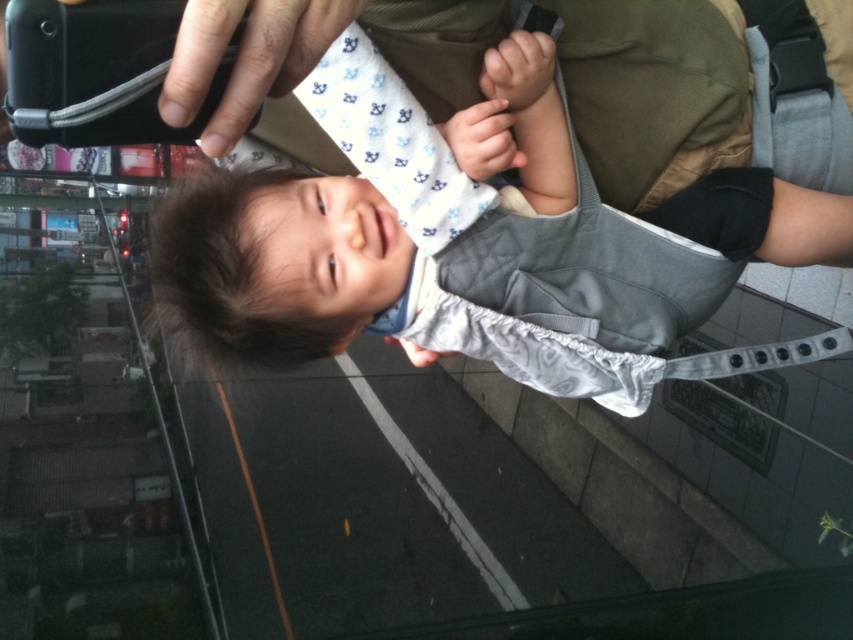
Based on the photo, between matte gray baby carrier at center and smooth white hand at center, which one appears on the left side from the viewer's perspective?

smooth white hand at center

Can you confirm if matte gray baby carrier at center is positioned below smooth white hand at center?

Indeed, matte gray baby carrier at center is positioned under smooth white hand at center.

Is point (450, 348) farther from viewer compared to point (447, 120)?

Yes, point (450, 348) is farther from viewer.

Where is `matte gray baby carrier at center`? This screenshot has height=640, width=853. matte gray baby carrier at center is located at coordinates (474, 243).

Is matte gray baby carrier at center further to the viewer compared to black matte phone at upper left?

Yes, it is.

Can you confirm if matte gray baby carrier at center is taller than black matte phone at upper left?

Correct, matte gray baby carrier at center is much taller as black matte phone at upper left.

The image size is (853, 640). In order to click on matte gray baby carrier at center in this screenshot , I will do `click(474, 243)`.

Is black matte phone at upper left wider than smooth white hand at center?

Yes, black matte phone at upper left is wider than smooth white hand at center.

The width and height of the screenshot is (853, 640). Find the location of `black matte phone at upper left`. black matte phone at upper left is located at coordinates (247, 58).

Between point (305, 42) and point (473, 116), which one is positioned in front?

Point (305, 42) is more forward.

Image resolution: width=853 pixels, height=640 pixels. Find the location of `black matte phone at upper left`. black matte phone at upper left is located at coordinates click(x=247, y=58).